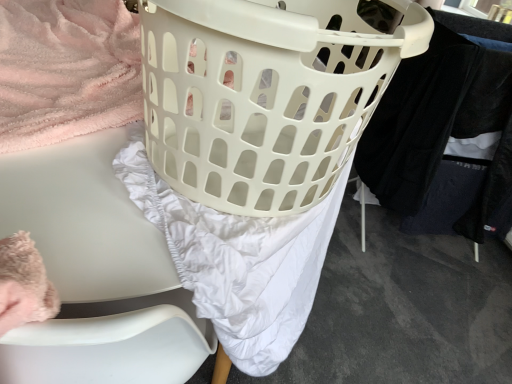
Question: Should I look upward or downward to see white plastic chair at left?

Choices:
 (A) up
 (B) down

Answer: (B)

Question: Is black cotton pants at right located outside white plastic chair at left?

Choices:
 (A) yes
 (B) no

Answer: (A)

Question: Could you tell me if black cotton pants at right is turned towards white plastic chair at left?

Choices:
 (A) yes
 (B) no

Answer: (B)

Question: Is black cotton pants at right touching white plastic chair at left?

Choices:
 (A) yes
 (B) no

Answer: (B)

Question: Does black cotton pants at right have a greater height compared to white plastic chair at left?

Choices:
 (A) no
 (B) yes

Answer: (B)

Question: Does black cotton pants at right come behind white plastic chair at left?

Choices:
 (A) yes
 (B) no

Answer: (A)

Question: Considering the relative sizes of black cotton pants at right and white plastic chair at left in the image provided, is black cotton pants at right smaller than white plastic chair at left?

Choices:
 (A) yes
 (B) no

Answer: (B)

Question: Considering the relative positions of white plastic laundry basket at center and white plastic chair at left in the image provided, is white plastic laundry basket at center to the left of white plastic chair at left from the viewer's perspective?

Choices:
 (A) yes
 (B) no

Answer: (B)

Question: Is the depth of white plastic laundry basket at center greater than that of white plastic chair at left?

Choices:
 (A) yes
 (B) no

Answer: (A)

Question: Does white plastic laundry basket at center have a larger size compared to white plastic chair at left?

Choices:
 (A) no
 (B) yes

Answer: (A)

Question: From a real-world perspective, is white plastic laundry basket at center positioned under white plastic chair at left based on gravity?

Choices:
 (A) yes
 (B) no

Answer: (B)

Question: Can you see white plastic laundry basket at center touching white plastic chair at left?

Choices:
 (A) yes
 (B) no

Answer: (B)

Question: Can you confirm if white plastic laundry basket at center is taller than white plastic chair at left?

Choices:
 (A) no
 (B) yes

Answer: (A)

Question: Is white plastic laundry basket at center turned away from black cotton pants at right?

Choices:
 (A) yes
 (B) no

Answer: (B)